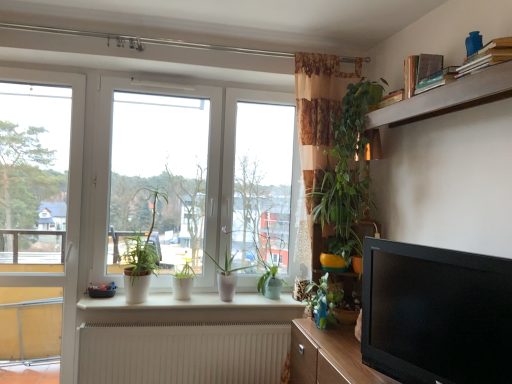
Find the location of a particular element. The image size is (512, 384). vacant space underneath green leafy plant at upper center, the 1th houseplant in the right-to-left sequence (from a real-world perspective) is located at coordinates 340,339.